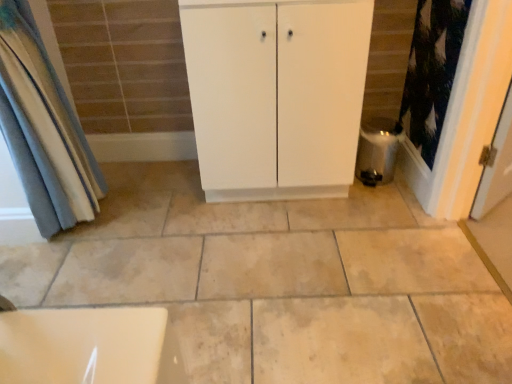
Question: Is blue fabric curtain at left facing towards white matte cabinet at center?

Choices:
 (A) no
 (B) yes

Answer: (B)

Question: Is the position of blue fabric curtain at left more distant than that of white matte cabinet at center?

Choices:
 (A) no
 (B) yes

Answer: (A)

Question: Considering the relative positions of blue fabric curtain at left and white matte cabinet at center in the image provided, is blue fabric curtain at left to the left of white matte cabinet at center from the viewer's perspective?

Choices:
 (A) yes
 (B) no

Answer: (A)

Question: From the image's perspective, is blue fabric curtain at left on white matte cabinet at center?

Choices:
 (A) no
 (B) yes

Answer: (A)

Question: Is blue fabric curtain at left bigger than white matte cabinet at center?

Choices:
 (A) no
 (B) yes

Answer: (A)

Question: Would you say blue fabric curtain at left is a long distance from white matte cabinet at center?

Choices:
 (A) no
 (B) yes

Answer: (A)

Question: From the image's perspective, is blue fabric curtain at left located above satin silver water heater at lower right?

Choices:
 (A) yes
 (B) no

Answer: (A)

Question: Is blue fabric curtain at left with satin silver water heater at lower right?

Choices:
 (A) yes
 (B) no

Answer: (B)

Question: From a real-world perspective, is blue fabric curtain at left located higher than satin silver water heater at lower right?

Choices:
 (A) no
 (B) yes

Answer: (B)

Question: Is blue fabric curtain at left positioned far away from satin silver water heater at lower right?

Choices:
 (A) no
 (B) yes

Answer: (B)

Question: Can you confirm if blue fabric curtain at left is shorter than satin silver water heater at lower right?

Choices:
 (A) yes
 (B) no

Answer: (B)

Question: Is blue fabric curtain at left aimed at satin silver water heater at lower right?

Choices:
 (A) yes
 (B) no

Answer: (A)

Question: Is white matte cabinet at center shorter than satin silver water heater at lower right?

Choices:
 (A) no
 (B) yes

Answer: (A)